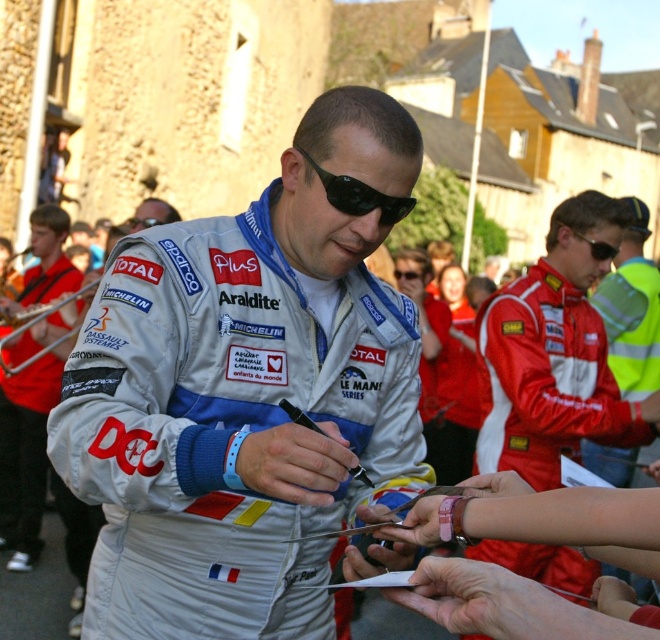
You are a photographer at the motorsport event and need to capture a closeup of the autograph signing. Since the silver metallic racing suit at center and the red fabric jacket at center are both in the frame, which one will appear bigger in your photo?

The silver metallic racing suit at center will appear bigger in the photo because it has a larger size compared to the red fabric jacket at center.

You are a photographer at the motorsport event. You want to capture a closeup shot of the central driver signing autographs. The camera you are using has a focal length of 100mm and a sensor size of 36mm. The point where the driver is standing is located at point coordinates point (636, 227). Given that the distance from the camera to this point is 43.74 meters, will the camera be able to fill the frame with the driver? Calculate the required focal length if the driver occupies 80 percent of the frame.

The distance of point (636, 227) from the camera is 43.74 meters. To determine if the current 100mm focal length can fill the frame, calculate the field of view. The sensor size is 36mm, so the horizontal FOV is 2 arctan half the sensor width divided by 2 times focal length. Plugging in 36mm sensor and 100mm focal length gives a horizontal FOV of approximately 40 degrees. The angular size of the driver at 43.74 meters would need to be 80 percent of the sensor width. Using trigonometry, the required focal.